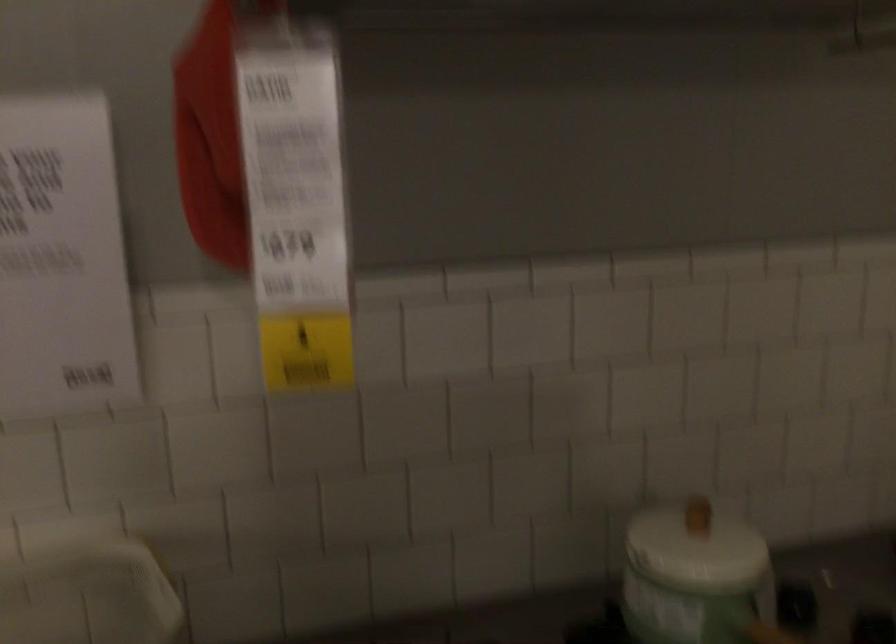
Question: How did the camera likely rotate?

Choices:
 (A) Left
 (B) Right
 (C) Up
 (D) Down

Answer: (A)